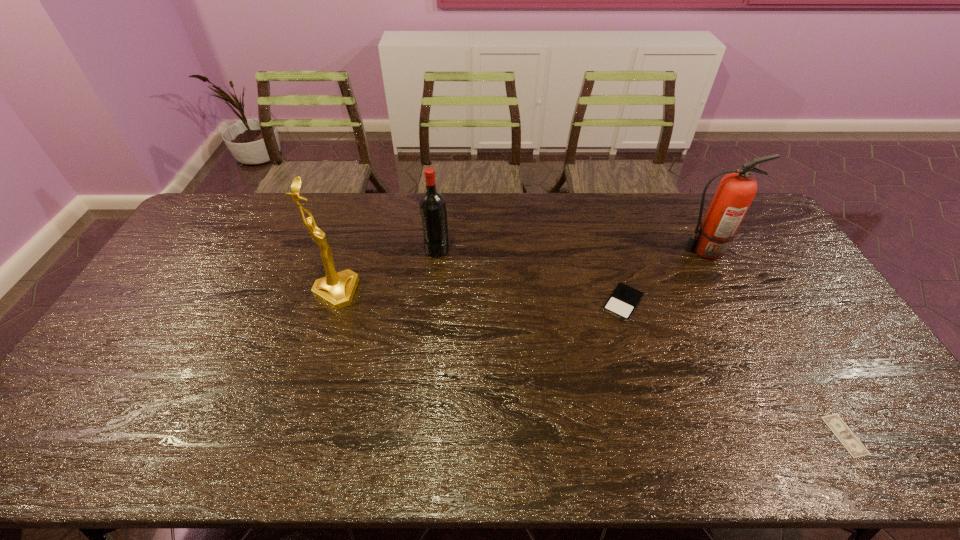
Locate an element on the screen. The height and width of the screenshot is (540, 960). vacant point located between the shortest object and the wine bottle is located at coordinates (640, 342).

Identify the location of empty location between the iPod and the wine bottle. (530, 275).

Identify which object is the second closest to the second object from left to right. Please provide its 2D coordinates. Your answer should be formatted as a tuple, i.e. [(x, y)], where the tuple contains the x and y coordinates of a point satisfying the conditions above.

[(623, 301)]

Image resolution: width=960 pixels, height=540 pixels. Identify the location of object that ranks as the fourth closest to the wine bottle. (847, 438).

Image resolution: width=960 pixels, height=540 pixels. In order to click on vacant space that satisfies the following two spatial constraints: 1. on the nozzle of the nearest object; 2. on the right side of the fire extinguisher in this screenshot , I will do `click(800, 435)`.

Identify the location of vacant space that satisfies the following two spatial constraints: 1. on the front side of the wine bottle; 2. on the right side of the money. (419, 435).

What are the coordinates of `vacant space that satisfies the following two spatial constraints: 1. on the back side of the fourth tallest object; 2. on the front-facing side of the leftmost object` in the screenshot? It's located at (619, 292).

Locate an element on the screen. The height and width of the screenshot is (540, 960). vacant space that satisfies the following two spatial constraints: 1. on the front side of the fourth tallest object; 2. on the right side of the wine bottle is located at coordinates (431, 303).